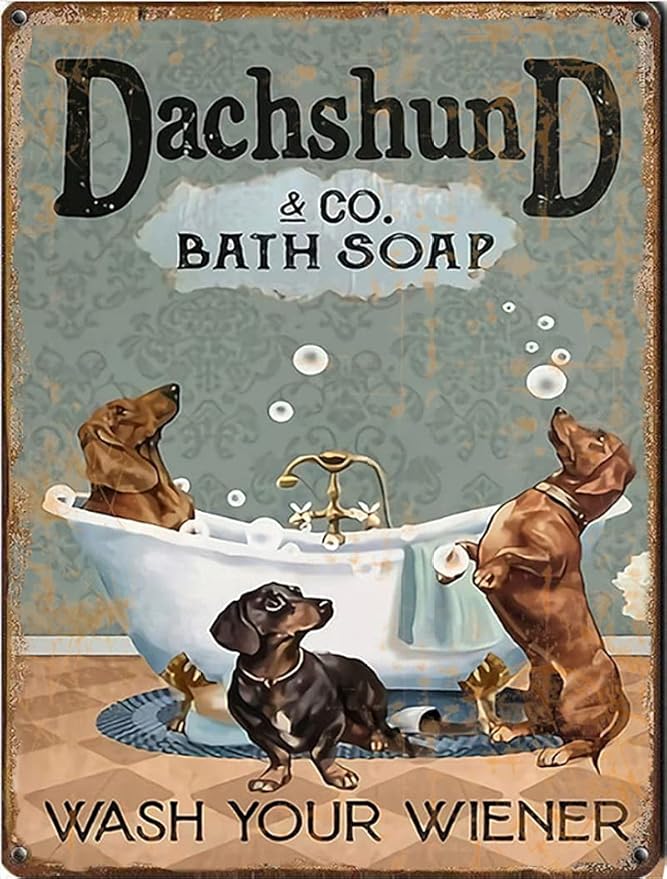
You are a GUI agent. You are given a task and a screenshot of the screen. Output one action in this format:
    pyautogui.click(x=<x>, y=<y>)
    Task: Click on the knob
    This screenshot has width=667, height=879.
    Given the screenshot: What is the action you would take?
    pyautogui.click(x=295, y=518)